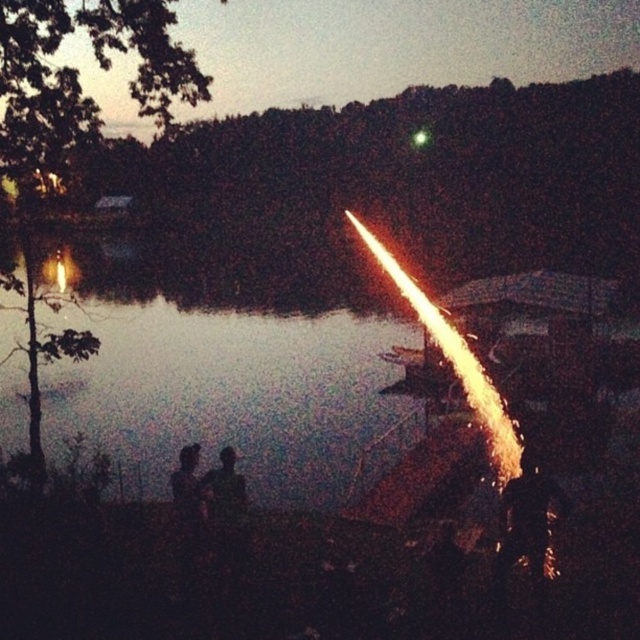
Who is taller, transparent water at center or black matte person at lower center?

transparent water at center

The image size is (640, 640). I want to click on transparent water at center, so click(236, 397).

Is point (380, 467) closer to camera compared to point (211, 486)?

That is False.

The width and height of the screenshot is (640, 640). Find the location of `transparent water at center`. transparent water at center is located at coordinates (236, 397).

Can you confirm if dark fabric figure at center is positioned above black matte person at lower center?

No.

Who is taller, dark fabric figure at center or black matte person at lower center?

Standing taller between the two is dark fabric figure at center.

Is point (524, 483) closer to viewer compared to point (241, 493)?

That is True.

Locate an element on the screen. The image size is (640, 640). dark fabric figure at center is located at coordinates (525, 520).

Is black matte person at lower center above dark hair human at center?

Actually, black matte person at lower center is below dark hair human at center.

Looking at this image, between black matte person at lower center and dark hair human at center, which one has more height?

A: Standing taller between the two is dark hair human at center.

Is point (241, 513) less distant than point (192, 476)?

No.

You are a GUI agent. You are given a task and a screenshot of the screen. Output one action in this format:
    pyautogui.click(x=<x>, y=<y>)
    Task: Click on the black matte person at lower center
    
    Given the screenshot: What is the action you would take?
    pyautogui.click(x=225, y=486)